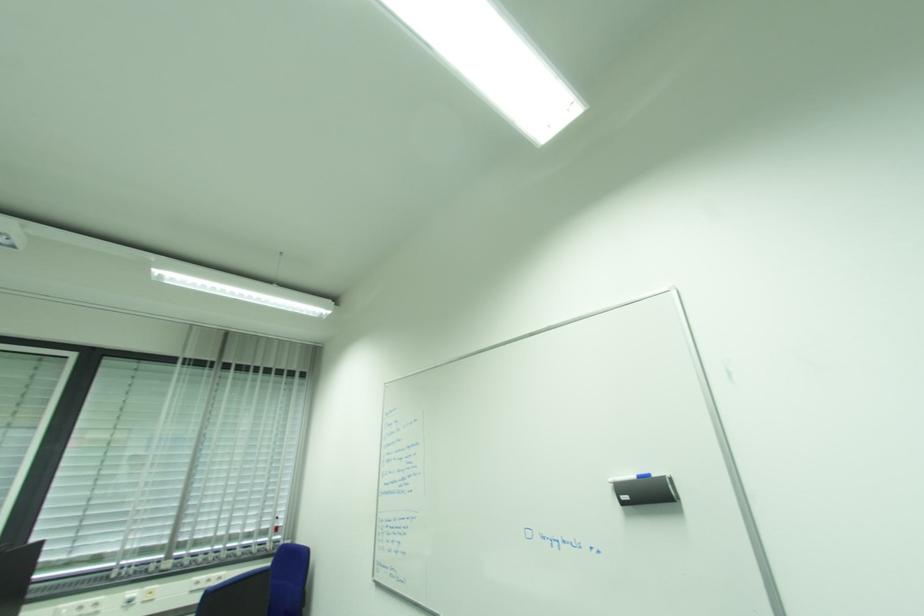
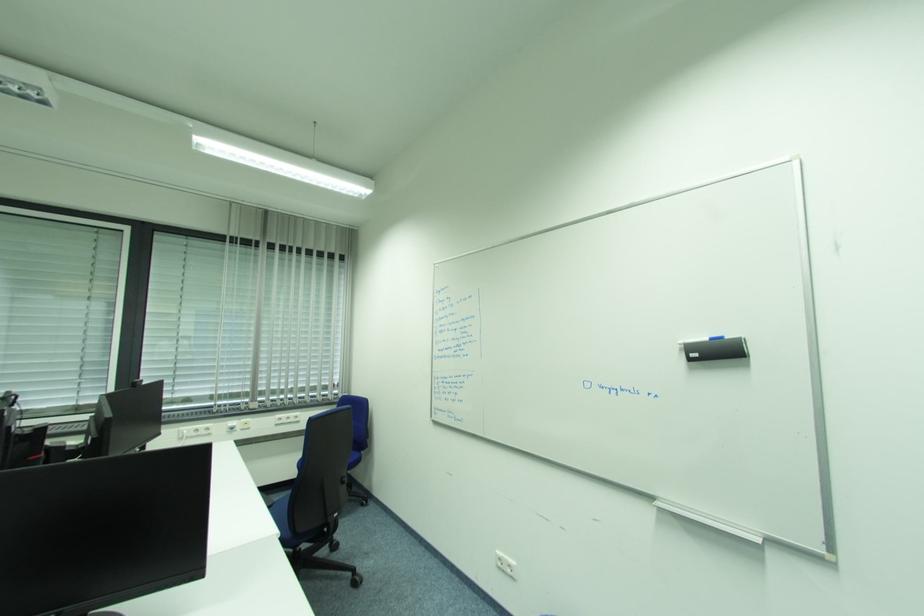
Question: Which direction would the cameraman need to move to produce the second image? Reply with the corresponding letter.

Choices:
 (A) Left
 (B) Right
 (C) Forward
 (D) Backward

Answer: (A)